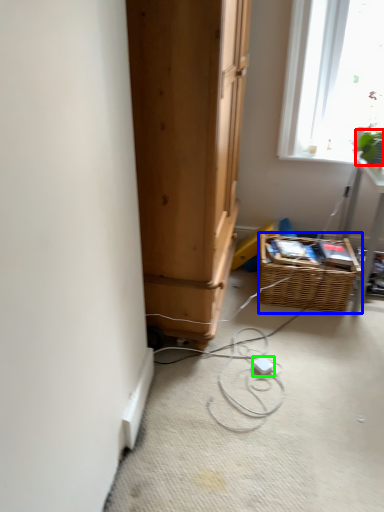
Question: Estimate the real-world distances between objects in this image. Which object is closer to plant (highlighted by a red box), basket (highlighted by a blue box) or extension cord (highlighted by a green box)?

Choices:
 (A) basket
 (B) extension cord

Answer: (A)